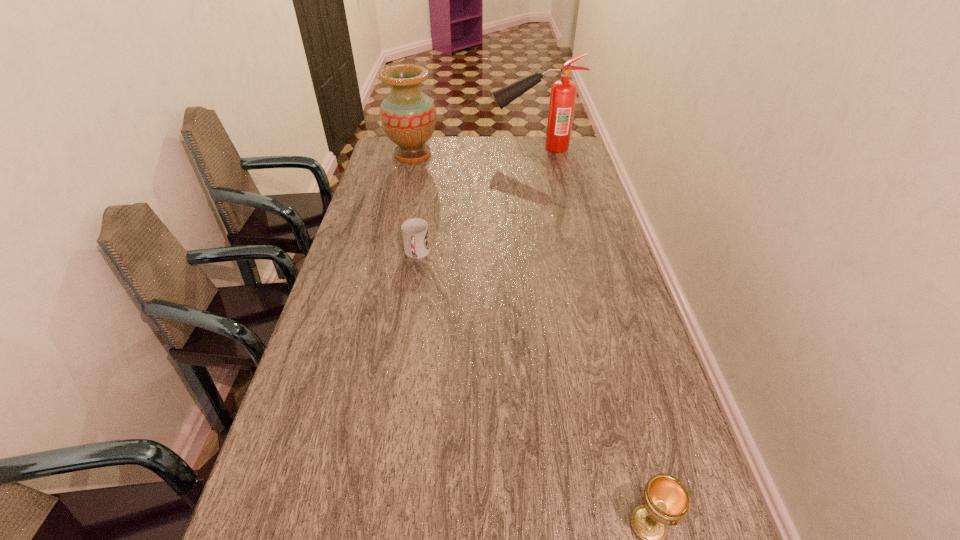
The width and height of the screenshot is (960, 540). In order to click on free space that satisfies the following two spatial constraints: 1. at the nozzle of the fire extinguisher; 2. on the side of the cup where the handle is located in this screenshot , I will do `click(555, 254)`.

Identify the location of blank space that satisfies the following two spatial constraints: 1. at the nozzle of the fire extinguisher; 2. on the side of the cup where the handle is located. This screenshot has height=540, width=960. click(555, 254).